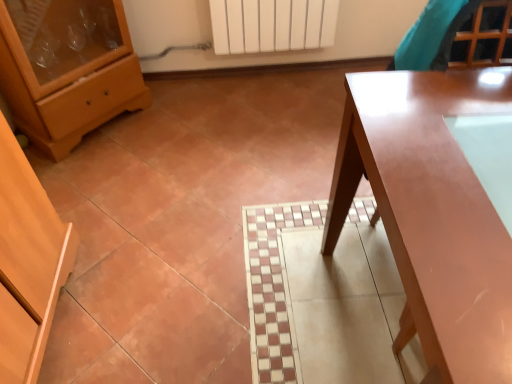
What do you see at coordinates (432, 213) in the screenshot? Image resolution: width=512 pixels, height=384 pixels. I see `glossy wood table at right` at bounding box center [432, 213].

In order to click on glossy wood table at right in this screenshot , I will do [432, 213].

Locate an element on the screen. The image size is (512, 384). matte wood chest of drawers at left is located at coordinates (70, 79).

This screenshot has width=512, height=384. Describe the element at coordinates (70, 79) in the screenshot. I see `matte wood chest of drawers at left` at that location.

Measure the distance between matte wood chest of drawers at left and camera.

The distance of matte wood chest of drawers at left from camera is 5.11 feet.

Where is `glossy wood table at right`? This screenshot has height=384, width=512. glossy wood table at right is located at coordinates (432, 213).

Which is more to the right, matte wood chest of drawers at left or glossy wood table at right?

glossy wood table at right is more to the right.

In the image, is matte wood chest of drawers at left positioned in front of or behind glossy wood table at right?

matte wood chest of drawers at left is behind glossy wood table at right.

Between point (11, 89) and point (490, 102), which one is positioned in front?

The point (490, 102) is more forward.

From the image's perspective, is matte wood chest of drawers at left above or below glossy wood table at right?

From the image's perspective, matte wood chest of drawers at left appears above glossy wood table at right.

From a real-world perspective, is matte wood chest of drawers at left located higher than glossy wood table at right?

Correct, in the physical world, matte wood chest of drawers at left is higher than glossy wood table at right.

Consider the image. Does matte wood chest of drawers at left have a lesser width compared to glossy wood table at right?

Yes.

Who is shorter, matte wood chest of drawers at left or glossy wood table at right?

With less height is matte wood chest of drawers at left.

Is matte wood chest of drawers at left smaller than glossy wood table at right?

Indeed, matte wood chest of drawers at left has a smaller size compared to glossy wood table at right.

Is glossy wood table at right surrounded by matte wood chest of drawers at left?

No, glossy wood table at right is not a part of matte wood chest of drawers at left.

Is matte wood chest of drawers at left in contact with glossy wood table at right?

No, matte wood chest of drawers at left is not in contact with glossy wood table at right.

Is matte wood chest of drawers at left looking in the opposite direction of glossy wood table at right?

No, matte wood chest of drawers at left is not facing away from glossy wood table at right.

The image size is (512, 384). I want to click on table that appears in front of the matte wood chest of drawers at left, so click(432, 213).

Can you confirm if glossy wood table at right is positioned to the left of matte wood chest of drawers at left?

No, glossy wood table at right is not to the left of matte wood chest of drawers at left.

Considering the positions of objects glossy wood table at right and matte wood chest of drawers at left in the image provided, who is behind, glossy wood table at right or matte wood chest of drawers at left?

matte wood chest of drawers at left.

Considering the points (429, 129) and (15, 86), which point is behind, point (429, 129) or point (15, 86)?

Positioned behind is point (15, 86).

From the image's perspective, which one is positioned lower, glossy wood table at right or matte wood chest of drawers at left?

glossy wood table at right is shown below in the image.

From a real-world perspective, is glossy wood table at right physically below matte wood chest of drawers at left?

Yes.

Considering the relative sizes of glossy wood table at right and matte wood chest of drawers at left in the image provided, is glossy wood table at right wider than matte wood chest of drawers at left?

Indeed, glossy wood table at right has a greater width compared to matte wood chest of drawers at left.

Can you confirm if glossy wood table at right is shorter than matte wood chest of drawers at left?

No, glossy wood table at right is not shorter than matte wood chest of drawers at left.

Considering the relative sizes of glossy wood table at right and matte wood chest of drawers at left in the image provided, is glossy wood table at right smaller than matte wood chest of drawers at left?

No, glossy wood table at right is not smaller than matte wood chest of drawers at left.

Would you say matte wood chest of drawers at left is part of glossy wood table at right's contents?

No, matte wood chest of drawers at left is not surrounded by glossy wood table at right.

Would you consider glossy wood table at right to be distant from matte wood chest of drawers at left?

Yes, glossy wood table at right and matte wood chest of drawers at left are quite far apart.

Is glossy wood table at right looking in the opposite direction of matte wood chest of drawers at left?

glossy wood table at right does not have its back to matte wood chest of drawers at left.

What's the angular difference between glossy wood table at right and matte wood chest of drawers at left's facing directions?

glossy wood table at right and matte wood chest of drawers at left are facing 48.6 degrees away from each other.

How much distance is there between glossy wood table at right and matte wood chest of drawers at left?

glossy wood table at right and matte wood chest of drawers at left are 4.66 feet apart.

Locate an element on the screen. The height and width of the screenshot is (384, 512). chest of drawers on the left of glossy wood table at right is located at coordinates (70, 79).

Where is `the chest of drawers that is above the glossy wood table at right (from the image's perspective)`? This screenshot has height=384, width=512. the chest of drawers that is above the glossy wood table at right (from the image's perspective) is located at coordinates (70, 79).

Locate an element on the screen. chest of drawers behind the glossy wood table at right is located at coordinates (70, 79).